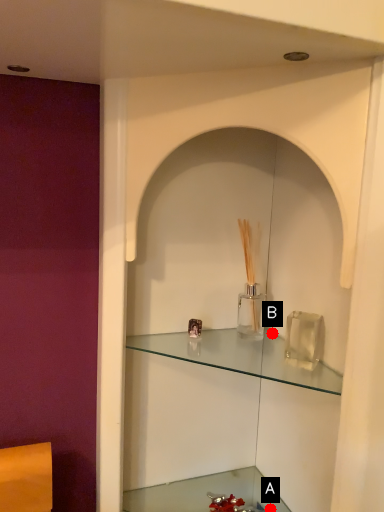
Question: Two points are circled on the image, labeled by A and B beside each circle. Which point appears farthest from the camera in this image?

Choices:
 (A) A is further
 (B) B is further

Answer: (A)